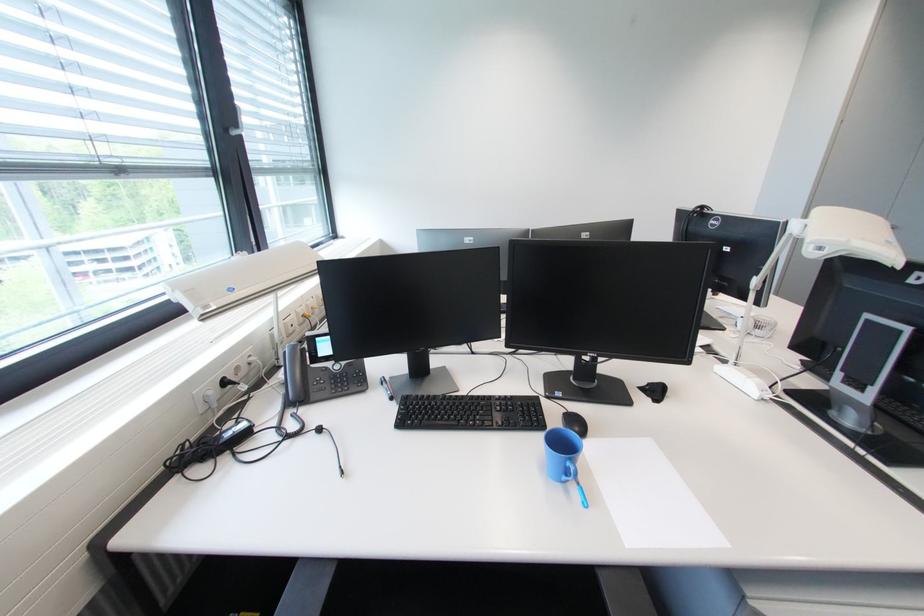
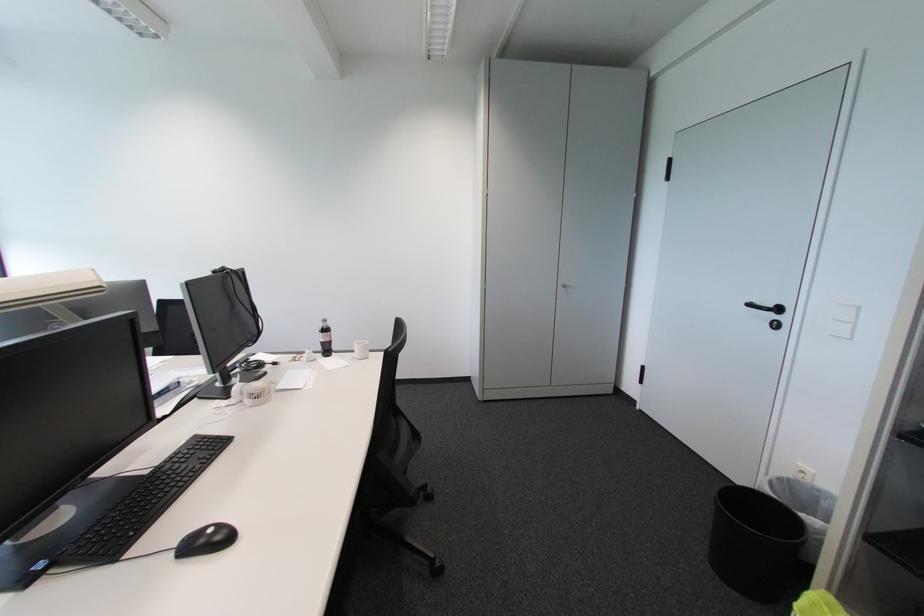
Question: In a continuous first-person perspective shot, in which direction is the camera moving?

Choices:
 (A) Left
 (B) Right
 (C) Forward
 (D) Backward

Answer: (B)